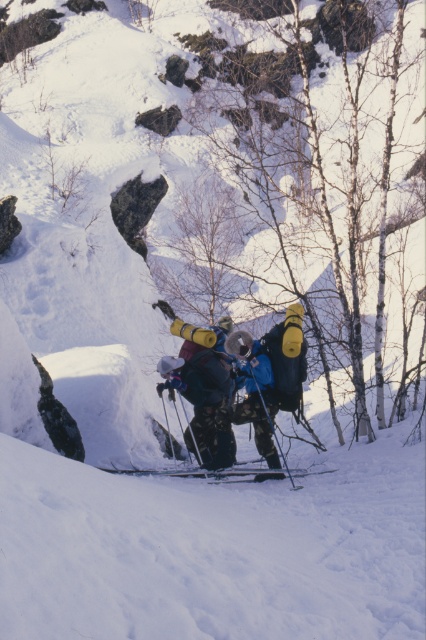
You are a winter hiker planning to cross this mountain area. You see the black matte ski at center and the matte black ski pole at center. Which one is shorter?

The black matte ski at center is shorter than the matte black ski pole at center.

You are a hiker trying to determine which item is bigger between the black matte ski at center and the matte black ski pole at center. Based on the scene, which one is larger?

The black matte ski at center is larger in size than the matte black ski pole at center.

Based on the coordinates provided, which object is located at point [198,392] in the winter mountain scene?

The point [198,392] marks the location of the dark blue ski suit at center.